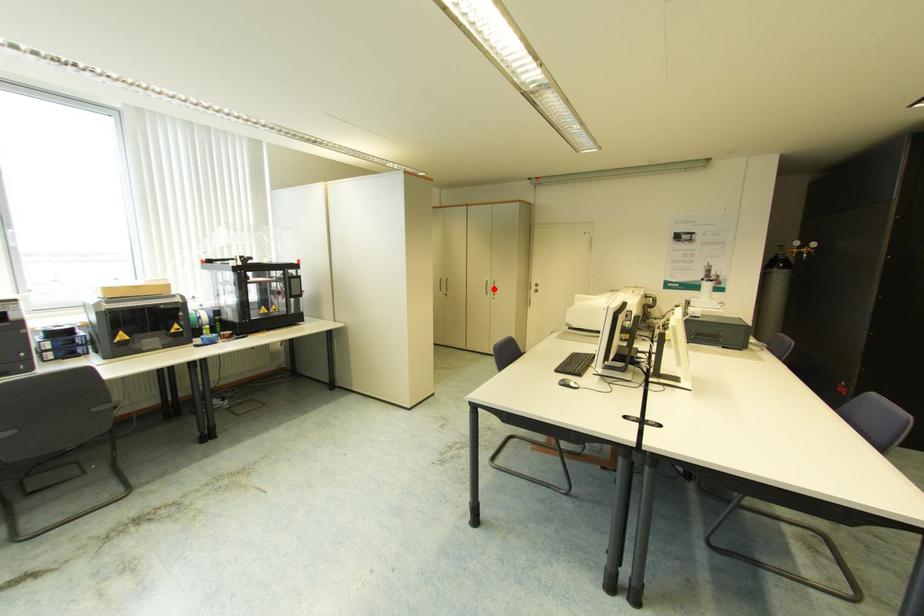
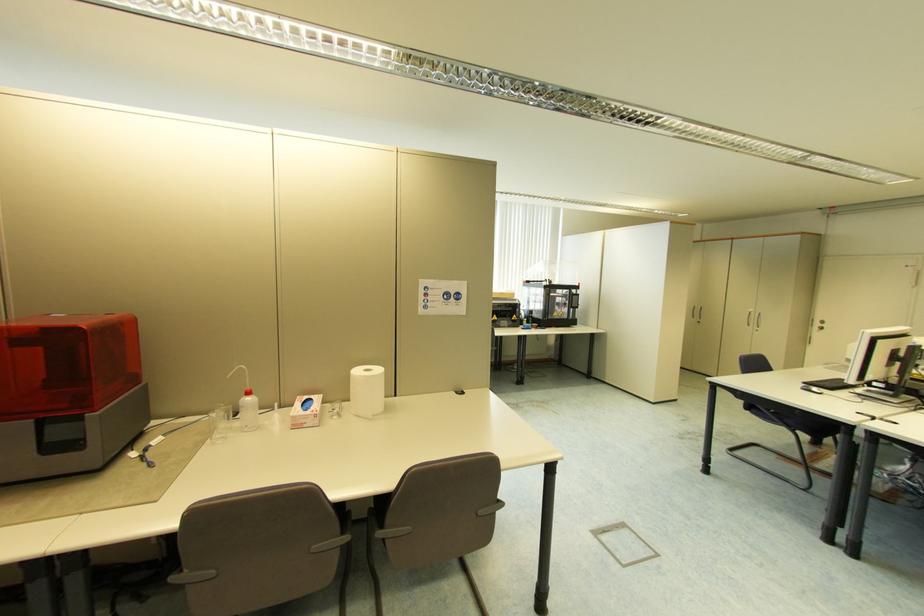
Locate, in the second image, the point that corresponds to the highlighted location in the first image.

(758, 321)